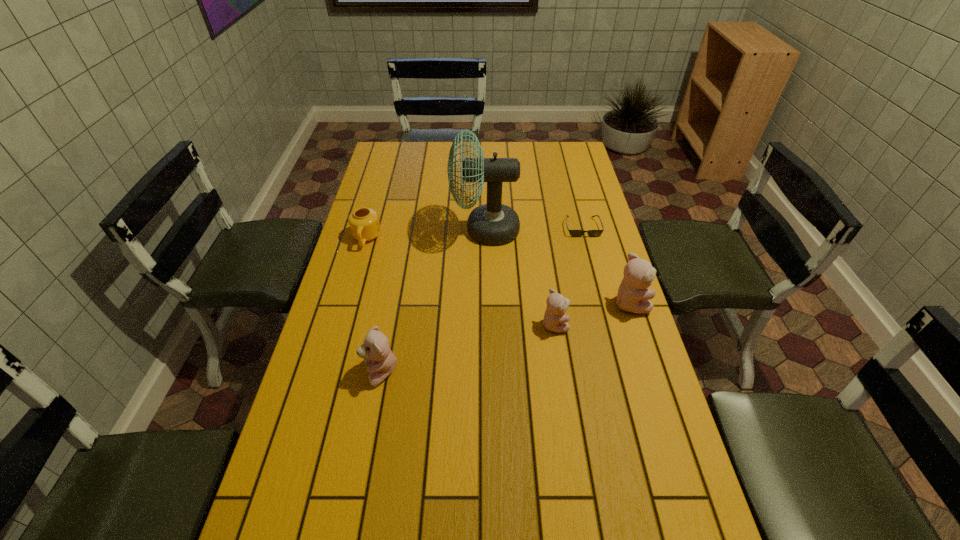
Find the location of a particular element. blank space located at the face of the fifth object from right to left is located at coordinates (344, 373).

Locate an element on the screen. This screenshot has width=960, height=540. vacant space situated 0.070m at the face of the fifth object from right to left is located at coordinates (336, 373).

The image size is (960, 540). Find the location of `vacant space located at the face of the fifth object from right to left`. vacant space located at the face of the fifth object from right to left is located at coordinates (310, 373).

This screenshot has height=540, width=960. In order to click on vacant space situated at the face of the third shortest object in this screenshot , I will do pos(630,324).

This screenshot has height=540, width=960. What are the coordinates of `vacant space located in front of the fan where the airflow is directed` in the screenshot? It's located at (432, 230).

What are the coordinates of `free point located in front of the fan where the airflow is directed` in the screenshot? It's located at (434, 230).

The width and height of the screenshot is (960, 540). Find the location of `vacant space located in front of the fan where the airflow is directed`. vacant space located in front of the fan where the airflow is directed is located at coordinates (381, 230).

Image resolution: width=960 pixels, height=540 pixels. I want to click on vacant area situated 0.260m on the handle side of the mug, so click(347, 310).

The image size is (960, 540). I want to click on free space located 0.050m on the front-facing side of the shortest object, so click(588, 247).

Find the location of a particular element. teddy bear that is at the left edge is located at coordinates (375, 350).